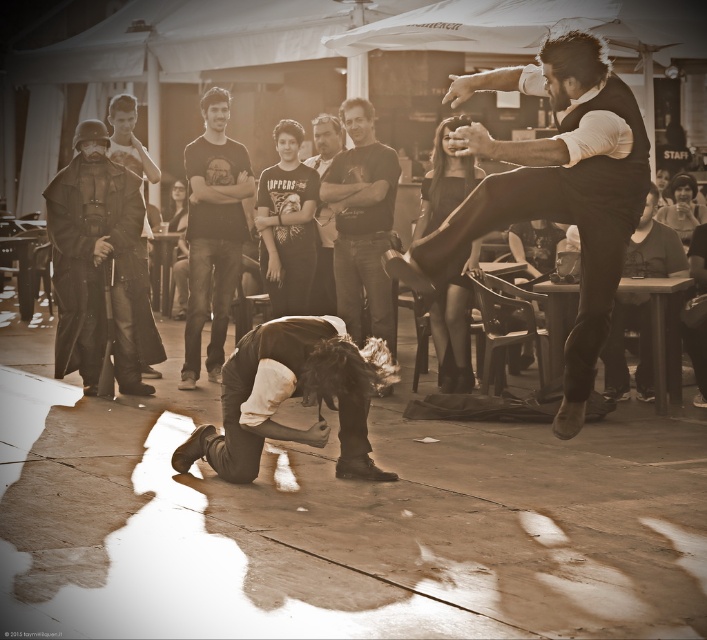
What is the object located at the coordinates point (x=286, y=224) in the image?

The object located at point (x=286, y=224) is the dark cotton t shirt at center.